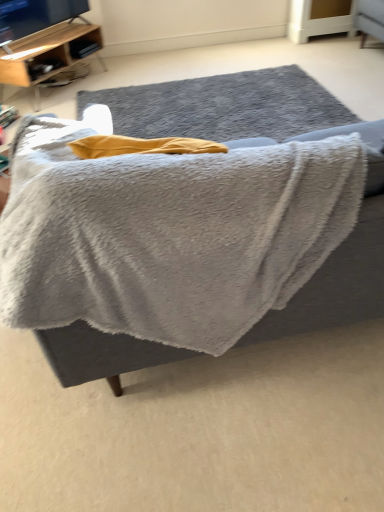
Question: Is point (226, 105) positioned closer to the camera than point (1, 80)?

Choices:
 (A) farther
 (B) closer

Answer: (B)

Question: From the image's perspective, is gray woolen rug at center located above or below wooden shelf at upper left?

Choices:
 (A) above
 (B) below

Answer: (B)

Question: Estimate the real-world distances between objects in this image. Which object is farther from the wooden shelf at upper left?

Choices:
 (A) gray woolen rug at center
 (B) gray fluffy blanket at center

Answer: (A)

Question: Based on their relative distances, which object is nearer to the gray woolen rug at center?

Choices:
 (A) gray fluffy blanket at center
 (B) wooden shelf at upper left

Answer: (A)